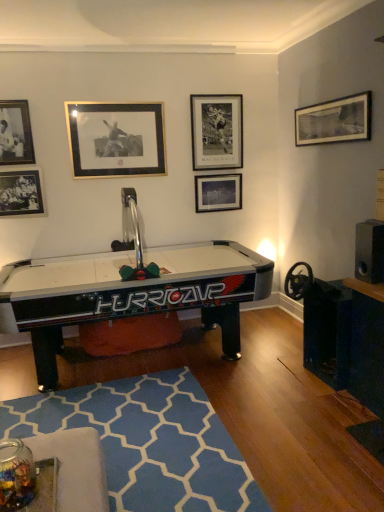
Find the location of `matte black picture frame at upper right, the 1th picture frame positioned from the right`. matte black picture frame at upper right, the 1th picture frame positioned from the right is located at coordinates (334, 121).

This screenshot has width=384, height=512. Identify the location of matte black picture frame at center, which is counted as the 2th picture frame, starting from the right. (218, 192).

The width and height of the screenshot is (384, 512). In order to click on black plastic air hockey table at center in this screenshot , I will do `click(129, 293)`.

Measure the distance between point (26,125) and camera.

The depth of point (26,125) is 3.67 meters.

The width and height of the screenshot is (384, 512). I want to click on blue fabric rug at lower center, so click(x=149, y=442).

Does black matte picture frame at lower left, which ranks as the 2th picture frame in left-to-right order, contain metallic silver picture frame at upper center, acting as the third picture frame starting from the right?

That's incorrect, metallic silver picture frame at upper center, acting as the third picture frame starting from the right, is not inside black matte picture frame at lower left, which ranks as the 2th picture frame in left-to-right order.

Does black matte picture frame at lower left, which ranks as the 2th picture frame in left-to-right order, have a greater height compared to metallic silver picture frame at upper center, which ranks as the fourth picture frame in left-to-right order?

No.

Which is closer, (17, 169) or (231, 143)?

The point (17, 169) is more forward.

Can you confirm if black matte picture frame at lower left, which ranks as the 2th picture frame in left-to-right order, is smaller than metallic silver picture frame at upper center, acting as the third picture frame starting from the right?

Yes, black matte picture frame at lower left, which ranks as the 2th picture frame in left-to-right order, is smaller than metallic silver picture frame at upper center, acting as the third picture frame starting from the right.

Which is farther from the camera, (330, 103) or (93, 310)?

Point (330, 103)

How distant is matte black picture frame at upper right, arranged as the sixth picture frame when viewed from the left, from black plastic air hockey table at center?

5.70 feet.

Is matte black picture frame at upper right, the 1th picture frame positioned from the right, completely or partially outside of black plastic air hockey table at center?

Absolutely, matte black picture frame at upper right, the 1th picture frame positioned from the right, is external to black plastic air hockey table at center.

Is matte black picture frame at upper right, the 1th picture frame positioned from the right, in front of or behind black plastic air hockey table at center in the image?

matte black picture frame at upper right, the 1th picture frame positioned from the right, is behind black plastic air hockey table at center.

Is metallic silver picture frame at upper center, acting as the third picture frame starting from the right, at the back of matte black picture frame at center, arranged as the 5th picture frame when viewed from the left?

matte black picture frame at center, arranged as the 5th picture frame when viewed from the left, does not have its back to metallic silver picture frame at upper center, acting as the third picture frame starting from the right.

Who is shorter, matte black picture frame at center, arranged as the 5th picture frame when viewed from the left, or metallic silver picture frame at upper center, acting as the third picture frame starting from the right?

matte black picture frame at center, arranged as the 5th picture frame when viewed from the left.

This screenshot has width=384, height=512. Identify the location of the 1st picture frame to the right of the metallic silver picture frame at upper center, which ranks as the fourth picture frame in left-to-right order, starting your count from the anchor. [218, 192].

Looking at their sizes, would you say matte black picture frame at upper left, the 6th picture frame from the right, is wider or thinner than black plastic speaker at right?

Clearly, matte black picture frame at upper left, the 6th picture frame from the right, has less width compared to black plastic speaker at right.

At what (x,y) coordinates should I click in order to perform the action: click on speaker that appears in front of the matte black picture frame at upper left, which is counted as the first picture frame, starting from the left. Please return your answer as a coordinate pair (x, y). This screenshot has width=384, height=512. Looking at the image, I should click on (369, 251).

Is black plastic speaker at right a part of matte black picture frame at upper left, which is counted as the first picture frame, starting from the left?

No, black plastic speaker at right is not a part of matte black picture frame at upper left, which is counted as the first picture frame, starting from the left.

Considering the positions of objects matte black picture frame at center, which is counted as the 2th picture frame, starting from the right, and blue fabric rug at lower center in the image provided, who is more to the right, matte black picture frame at center, which is counted as the 2th picture frame, starting from the right, or blue fabric rug at lower center?

matte black picture frame at center, which is counted as the 2th picture frame, starting from the right.

Could you tell me if matte black picture frame at center, arranged as the 5th picture frame when viewed from the left, is facing blue fabric rug at lower center?

No, matte black picture frame at center, arranged as the 5th picture frame when viewed from the left, is not oriented towards blue fabric rug at lower center.

Which point is more forward, (209, 184) or (29, 419)?

Point (29, 419)

Is gold-framed print at upper center, marked as the fourth picture frame in a right-to-left arrangement, taller than matte black picture frame at upper left, the 6th picture frame from the right?

Indeed, gold-framed print at upper center, marked as the fourth picture frame in a right-to-left arrangement, has a greater height compared to matte black picture frame at upper left, the 6th picture frame from the right.

Consider the image. From a real-world perspective, which is physically below, gold-framed print at upper center, which ranks as the 3th picture frame in left-to-right order, or matte black picture frame at upper left, the 6th picture frame from the right?

gold-framed print at upper center, which ranks as the 3th picture frame in left-to-right order, from a real-world perspective.

Is gold-framed print at upper center, marked as the fourth picture frame in a right-to-left arrangement, at the left side of matte black picture frame at upper left, which is counted as the first picture frame, starting from the left?

Incorrect, gold-framed print at upper center, marked as the fourth picture frame in a right-to-left arrangement, is not on the left side of matte black picture frame at upper left, which is counted as the first picture frame, starting from the left.

You are a GUI agent. You are given a task and a screenshot of the screen. Output one action in this format:
    pyautogui.click(x=<x>, y=<y>)
    Task: Click on the 2nd picture frame in front of the gold-framed print at upper center, marked as the fourth picture frame in a right-to-left arrangement
    
    Given the screenshot: What is the action you would take?
    click(x=15, y=133)

Based on their sizes in the image, would you say metallic silver picture frame at upper center, which ranks as the fourth picture frame in left-to-right order, is bigger or smaller than blue fabric rug at lower center?

Clearly, metallic silver picture frame at upper center, which ranks as the fourth picture frame in left-to-right order, is smaller in size than blue fabric rug at lower center.

Based on their positions, is metallic silver picture frame at upper center, which ranks as the fourth picture frame in left-to-right order, located to the left or right of blue fabric rug at lower center?

Clearly, metallic silver picture frame at upper center, which ranks as the fourth picture frame in left-to-right order, is on the right of blue fabric rug at lower center in the image.

From a real-world perspective, which is physically below, metallic silver picture frame at upper center, which ranks as the fourth picture frame in left-to-right order, or blue fabric rug at lower center?

From a 3D spatial view, blue fabric rug at lower center is below.

From the image's perspective, is metallic silver picture frame at upper center, acting as the third picture frame starting from the right, above blue fabric rug at lower center?

Yes, from the image's perspective, metallic silver picture frame at upper center, acting as the third picture frame starting from the right, is on top of blue fabric rug at lower center.

From the image's perspective, count 5th picture frames upward from the black matte picture frame at lower left, which ranks as the 2th picture frame in left-to-right order, and point to it. Please provide its 2D coordinates.

[(217, 131)]

Locate an element on the screen. the 1st picture frame behind the black plastic air hockey table at center is located at coordinates (334, 121).

When comparing their distances from metallic silver picture frame at upper center, which ranks as the fourth picture frame in left-to-right order, does black matte picture frame at lower left, marked as the 5th picture frame in a right-to-left arrangement, or blue fabric rug at lower center seem closer?

black matte picture frame at lower left, marked as the 5th picture frame in a right-to-left arrangement, is closer to metallic silver picture frame at upper center, which ranks as the fourth picture frame in left-to-right order.

Based on their spatial positions, is matte black picture frame at upper left, which is counted as the first picture frame, starting from the left, or metallic silver picture frame at upper center, which ranks as the fourth picture frame in left-to-right order, further from black matte picture frame at lower left, which ranks as the 2th picture frame in left-to-right order?

metallic silver picture frame at upper center, which ranks as the fourth picture frame in left-to-right order, is further to black matte picture frame at lower left, which ranks as the 2th picture frame in left-to-right order.

Which object lies further to the anchor point matte black picture frame at center, arranged as the 5th picture frame when viewed from the left, matte black picture frame at upper right, arranged as the sixth picture frame when viewed from the left, or black plastic air hockey table at center?

black plastic air hockey table at center.

Considering their positions, is matte black picture frame at center, arranged as the 5th picture frame when viewed from the left, positioned further to matte black picture frame at upper right, the 1th picture frame positioned from the right, than blue fabric rug at lower center?

blue fabric rug at lower center is positioned further to the anchor matte black picture frame at upper right, the 1th picture frame positioned from the right.

From the image, which object appears to be nearer to matte black picture frame at upper right, arranged as the sixth picture frame when viewed from the left, matte black picture frame at upper left, the 6th picture frame from the right, or matte black picture frame at center, arranged as the 5th picture frame when viewed from the left?

matte black picture frame at center, arranged as the 5th picture frame when viewed from the left, lies closer to matte black picture frame at upper right, arranged as the sixth picture frame when viewed from the left, than the other object.

Which object lies further to the anchor point metallic silver picture frame at upper center, which ranks as the fourth picture frame in left-to-right order, matte black picture frame at upper left, the 6th picture frame from the right, or matte black picture frame at upper right, arranged as the sixth picture frame when viewed from the left?

Among the two, matte black picture frame at upper left, the 6th picture frame from the right, is located further to metallic silver picture frame at upper center, which ranks as the fourth picture frame in left-to-right order.

Based on their spatial positions, is blue fabric rug at lower center or matte black picture frame at upper right, arranged as the sixth picture frame when viewed from the left, closer to gold-framed print at upper center, which ranks as the 3th picture frame in left-to-right order?

matte black picture frame at upper right, arranged as the sixth picture frame when viewed from the left, is closer to gold-framed print at upper center, which ranks as the 3th picture frame in left-to-right order.

Looking at the image, which one is located further to black matte picture frame at lower left, which ranks as the 2th picture frame in left-to-right order, matte black picture frame at upper right, arranged as the sixth picture frame when viewed from the left, or blue fabric rug at lower center?

Based on the image, matte black picture frame at upper right, arranged as the sixth picture frame when viewed from the left, appears to be further to black matte picture frame at lower left, which ranks as the 2th picture frame in left-to-right order.

Where is `table that lies between matte black picture frame at upper left, the 6th picture frame from the right, and blue fabric rug at lower center from top to bottom`? Image resolution: width=384 pixels, height=512 pixels. table that lies between matte black picture frame at upper left, the 6th picture frame from the right, and blue fabric rug at lower center from top to bottom is located at coordinates (129, 293).

At what (x,y) coordinates should I click in order to perform the action: click on table between blue fabric rug at lower center and matte black picture frame at center, which is counted as the 2th picture frame, starting from the right, from front to back. Please return your answer as a coordinate pair (x, y). The image size is (384, 512). Looking at the image, I should click on (129, 293).

You are a GUI agent. You are given a task and a screenshot of the screen. Output one action in this format:
    pyautogui.click(x=<x>, y=<y>)
    Task: Click on the table between matte black picture frame at upper left, the 6th picture frame from the right, and matte black picture frame at center, arranged as the 5th picture frame when viewed from the left, from left to right
    
    Given the screenshot: What is the action you would take?
    pyautogui.click(x=129, y=293)

You are a GUI agent. You are given a task and a screenshot of the screen. Output one action in this format:
    pyautogui.click(x=<x>, y=<y>)
    Task: Click on the mat situated between black plastic air hockey table at center and black plastic speaker at right from left to right
    
    Given the screenshot: What is the action you would take?
    pyautogui.click(x=149, y=442)